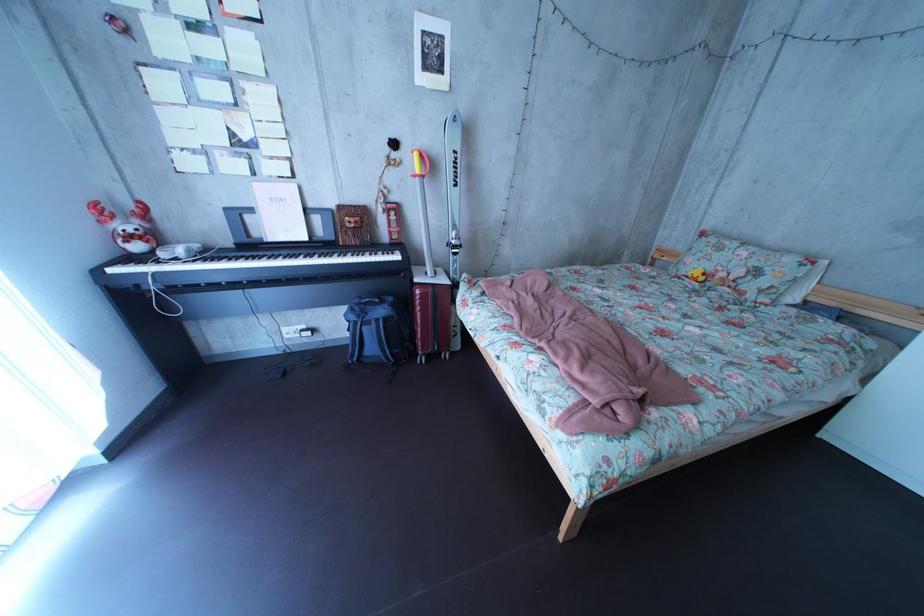
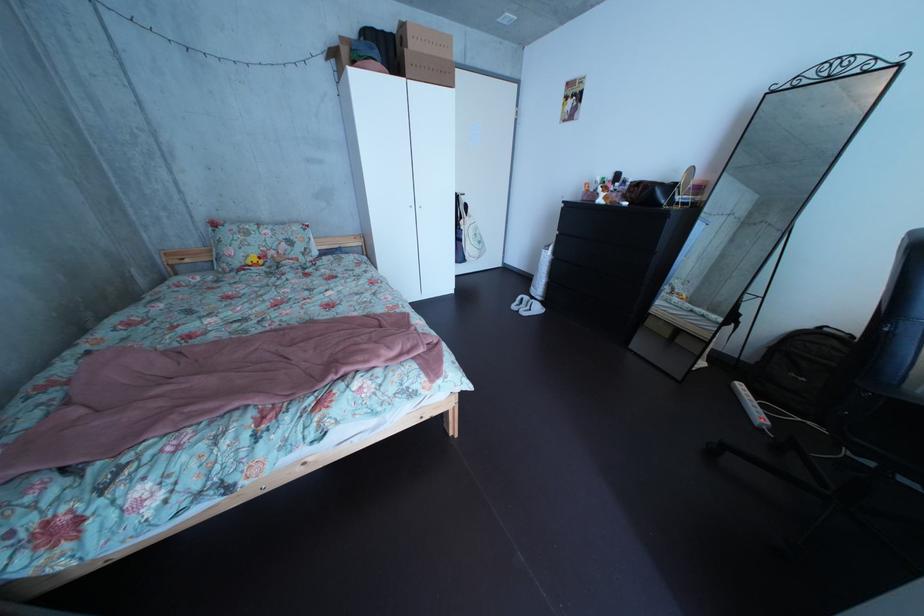
How did the camera likely rotate?

The camera's rotation is toward right-down.